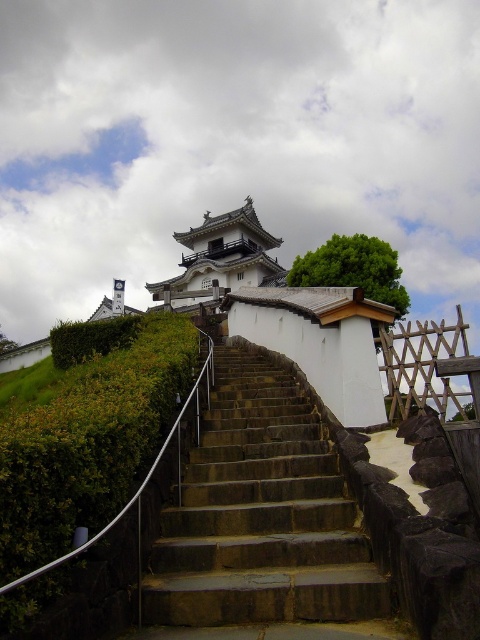
You are a visitor approaching the white stone temple at upper center via the stone steps. As you walk up, you notice the green leafy hedge at lower left. Which object takes up more space in the scene?

The white stone temple at upper center takes up more space in the scene than the green leafy hedge at lower left because the green leafy hedge at lower left occupies less space than white stone temple at upper center.

You are a tourist standing at the base of the stone stairs at center, looking up towards the white stone temple at upper center. Which object is closer to you?

The stone stairs at center is closer to the viewer than the white stone temple at upper center.

You are a visitor approaching the castle from the bottom of the hill. You see the stone stairs at center and the green leafy hedge at lower left. Which object is closer to you as you approach?

The green leafy hedge at lower left is closer to you as you approach because it is positioned at the lower left, which is typically the foreground in such scenes.